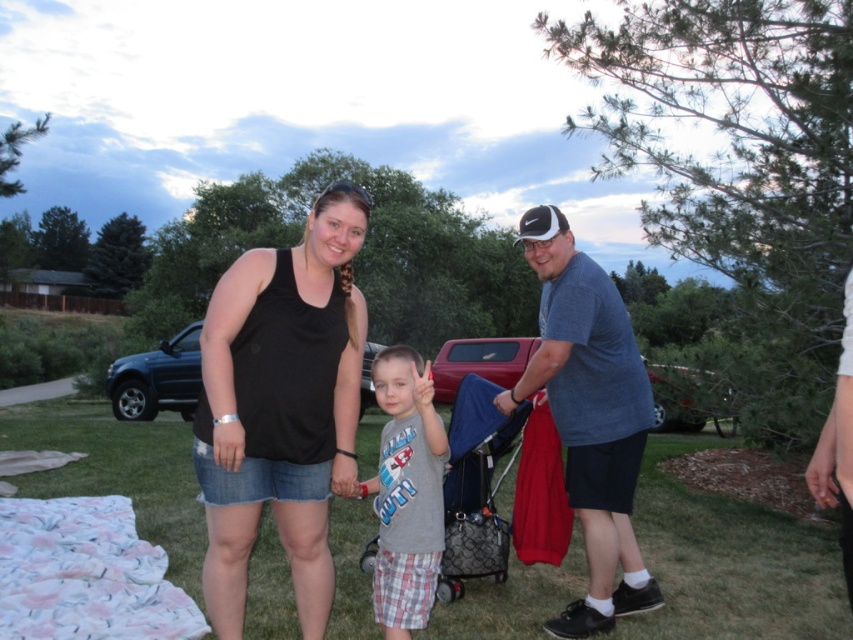
Consider the image. You are a fashion designer observing the clothing items in the image. Which clothing item has a larger size between the black cotton tank top at center and the gray cotton shirt at center?

The black cotton tank top at center is bigger than the gray cotton shirt at center.

You are planning to take a nap in the outdoor scene described. You see the blue cotton shirt at center and the fluffy cotton blanket at lower left. Which object is closer to you if you want to lie down on the blanket?

The fluffy cotton blanket at lower left is behind the blue cotton shirt at center, so the blue cotton shirt at center is closer to you. To lie down on the blanket, you would need to move past the blue cotton shirt at center.